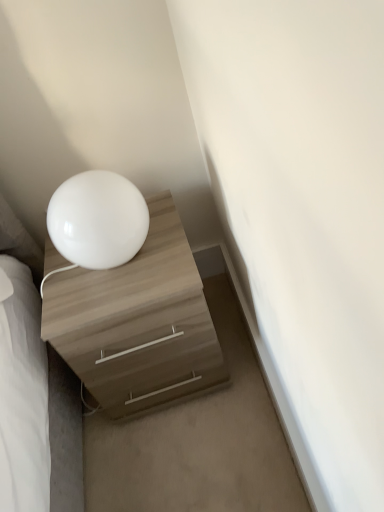
Question: Is matte wood chest of drawers at lower left facing away from white glossy table lamp at upper left?

Choices:
 (A) no
 (B) yes

Answer: (A)

Question: Does matte wood chest of drawers at lower left appear on the right side of white glossy table lamp at upper left?

Choices:
 (A) yes
 (B) no

Answer: (A)

Question: Can you confirm if matte wood chest of drawers at lower left is positioned to the left of white glossy table lamp at upper left?

Choices:
 (A) no
 (B) yes

Answer: (A)

Question: Is matte wood chest of drawers at lower left thinner than white glossy table lamp at upper left?

Choices:
 (A) yes
 (B) no

Answer: (B)

Question: Is matte wood chest of drawers at lower left smaller than white glossy table lamp at upper left?

Choices:
 (A) no
 (B) yes

Answer: (A)

Question: From the image's perspective, is matte wood chest of drawers at lower left on white glossy table lamp at upper left?

Choices:
 (A) yes
 (B) no

Answer: (B)

Question: Is white glossy table lamp at upper left at the left side of matte wood chest of drawers at lower left?

Choices:
 (A) yes
 (B) no

Answer: (A)

Question: Is white glossy table lamp at upper left touching matte wood chest of drawers at lower left?

Choices:
 (A) no
 (B) yes

Answer: (A)

Question: Is white glossy table lamp at upper left closer to camera compared to matte wood chest of drawers at lower left?

Choices:
 (A) no
 (B) yes

Answer: (B)

Question: From a real-world perspective, is white glossy table lamp at upper left positioned over matte wood chest of drawers at lower left based on gravity?

Choices:
 (A) yes
 (B) no

Answer: (A)

Question: Does white glossy table lamp at upper left contain matte wood chest of drawers at lower left?

Choices:
 (A) yes
 (B) no

Answer: (B)

Question: Can you confirm if white glossy table lamp at upper left is smaller than matte wood chest of drawers at lower left?

Choices:
 (A) yes
 (B) no

Answer: (A)

Question: Considering the positions of matte wood chest of drawers at lower left and white glossy table lamp at upper left in the image, is matte wood chest of drawers at lower left wider or thinner than white glossy table lamp at upper left?

Choices:
 (A) thin
 (B) wide

Answer: (B)